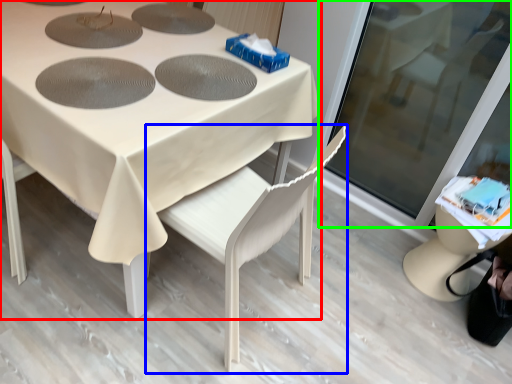
Question: Based on their relative distances, which object is nearer to table (highlighted by a red box)? Choose from chair (highlighted by a blue box) and screen door (highlighted by a green box).

Choices:
 (A) chair
 (B) screen door

Answer: (A)